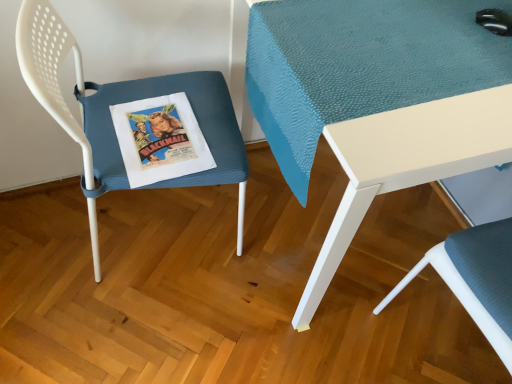
Find the location of a particular element. vacant location below blue textured cushion at left, which appears as the 2th chair when viewed from the right (from a real-world perspective) is located at coordinates (163, 231).